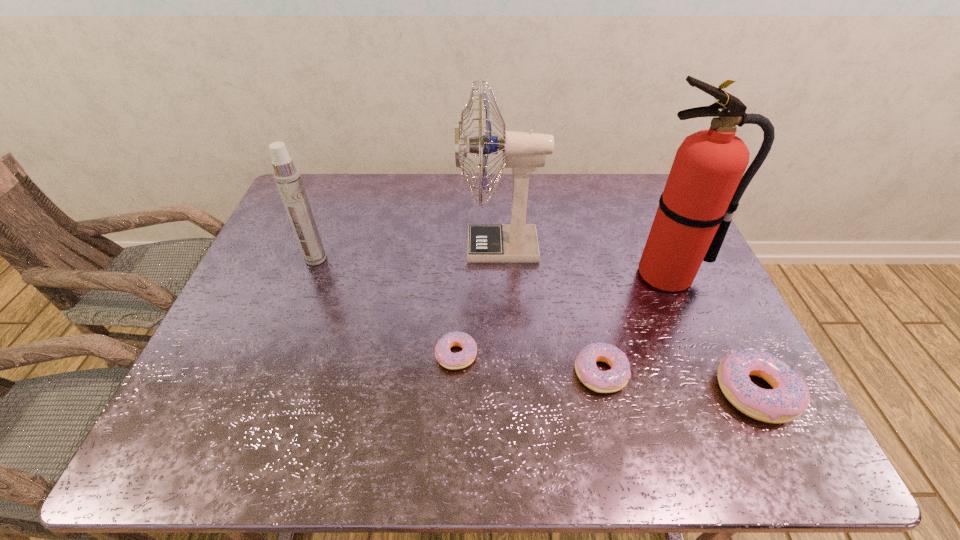
This screenshot has height=540, width=960. Identify the location of vacant space in between the fan and the rightmost doughnut. (628, 319).

Identify the location of free spot between the fan and the second shortest doughnut. (550, 310).

Find the location of a particular element. vacant area that lies between the fire extinguisher and the third shortest object is located at coordinates (711, 333).

Where is `free space between the fourth tallest object and the aerosol can`? free space between the fourth tallest object and the aerosol can is located at coordinates (536, 325).

This screenshot has height=540, width=960. In order to click on vacant area that lies between the second shortest doughnut and the shortest doughnut in this screenshot , I will do [528, 363].

Where is `free space that is in between the second tallest doughnut and the aerosol can`? The height and width of the screenshot is (540, 960). free space that is in between the second tallest doughnut and the aerosol can is located at coordinates (458, 315).

Identify which object is the fourth nearest to the rightmost doughnut. Please provide its 2D coordinates. Your answer should be formatted as a tuple, i.e. [(x, y)], where the tuple contains the x and y coordinates of a point satisfying the conditions above.

[(453, 361)]

Find the location of a particular element. The height and width of the screenshot is (540, 960). the fourth closest object relative to the leftmost object is located at coordinates (705, 184).

Locate which doughnut ranks in proximity to the fan. Please provide its 2D coordinates. Your answer should be formatted as a tuple, i.e. [(x, y)], where the tuple contains the x and y coordinates of a point satisfying the conditions above.

[(453, 361)]

You are a GUI agent. You are given a task and a screenshot of the screen. Output one action in this format:
    pyautogui.click(x=<x>, y=<y>)
    Task: Click on the doughnut that stands as the second closest to the second doughnut from left to right
    
    Given the screenshot: What is the action you would take?
    pyautogui.click(x=453, y=361)